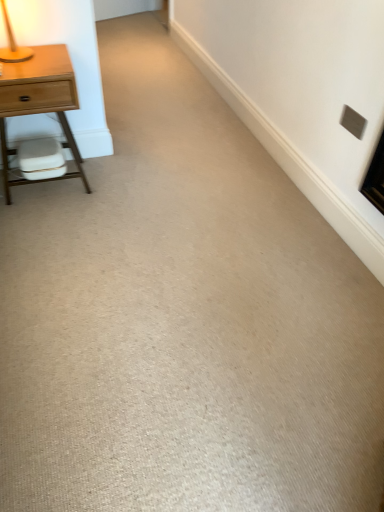
Question: Considering the relative positions of white matte swivel chair at left and light wood/finish nightstand at left in the image provided, is white matte swivel chair at left to the left or to the right of light wood/finish nightstand at left?

Choices:
 (A) right
 (B) left

Answer: (A)

Question: From a real-world perspective, is white matte swivel chair at left above or below light wood/finish nightstand at left?

Choices:
 (A) above
 (B) below

Answer: (B)

Question: Estimate the real-world distances between objects in this image. Which object is farther from the wooden table lamp at upper left?

Choices:
 (A) light wood/finish nightstand at left
 (B) white matte swivel chair at left
 (C) gray matte electric outlet at upper right

Answer: (C)

Question: Which object is positioned closest to the gray matte electric outlet at upper right?

Choices:
 (A) wooden table lamp at upper left
 (B) white matte swivel chair at left
 (C) light wood/finish nightstand at left

Answer: (C)